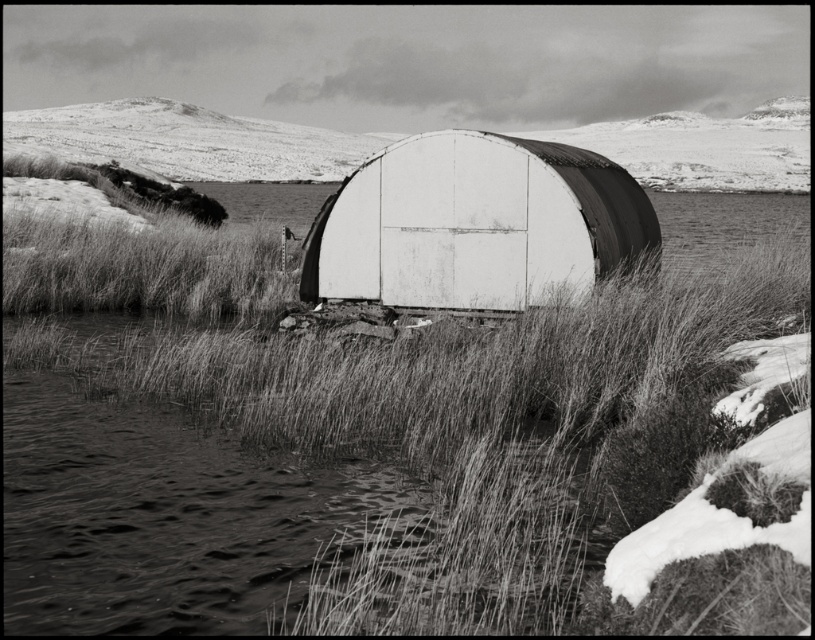
Question: Which object is the farthest from the smooth white dome at center?

Choices:
 (A) fuzzy grass at center
 (B) white corrugated metal hut at center

Answer: (B)

Question: Does fuzzy grass at center come behind smooth white dome at center?

Choices:
 (A) no
 (B) yes

Answer: (A)

Question: Based on their relative distances, which object is farther from the fuzzy grass at center?

Choices:
 (A) smooth white dome at center
 (B) white corrugated metal hut at center

Answer: (A)

Question: Can you confirm if white corrugated metal hut at center is wider than smooth white dome at center?

Choices:
 (A) yes
 (B) no

Answer: (B)

Question: From the image, what is the correct spatial relationship of fuzzy grass at center in relation to smooth white dome at center?

Choices:
 (A) left
 (B) right

Answer: (A)

Question: Which object is the farthest from the smooth white dome at center?

Choices:
 (A) fuzzy grass at center
 (B) white corrugated metal hut at center

Answer: (B)